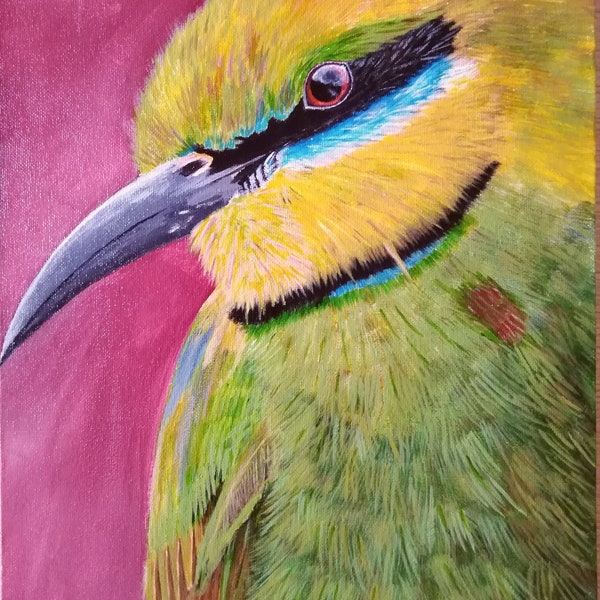
You are a GUI agent. You are given a task and a screenshot of the screen. Output one action in this format:
    pyautogui.click(x=<x>, y=<y>)
    Task: Click on the chest
    The width and height of the screenshot is (600, 600).
    Given the screenshot: What is the action you would take?
    pyautogui.click(x=374, y=385)